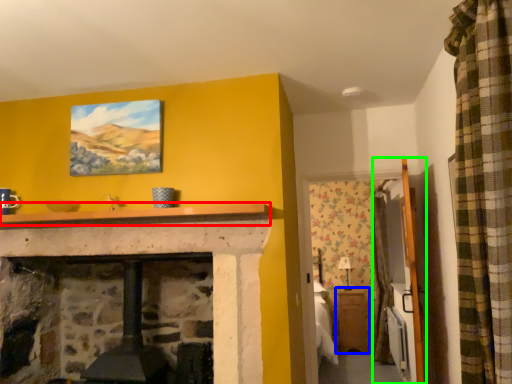
Question: Which object is the farthest from mantle (highlighted by a red box)? Choose among these: table (highlighted by a blue box) or armoire (highlighted by a green box).

Choices:
 (A) table
 (B) armoire

Answer: (A)